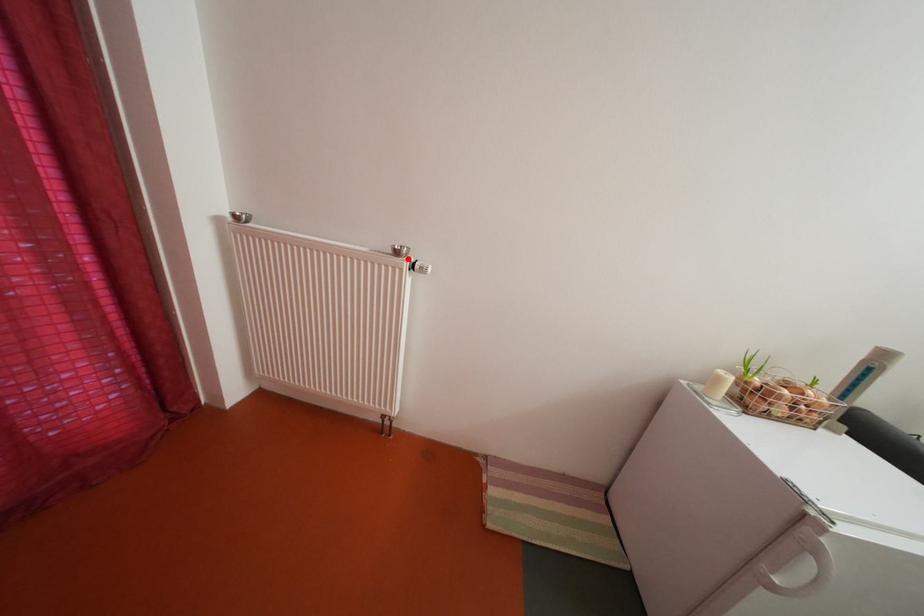
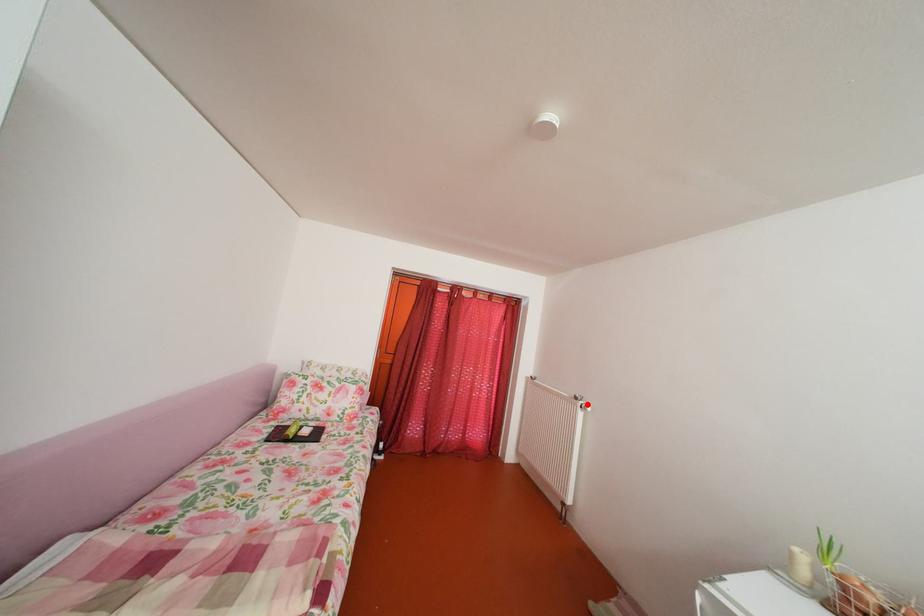
I am providing you with two images of the same scene from different viewpoints. A red point is marked on the first image and another point is marked on the second image. Is the red point in image1 aligned with the point shown in image2?

Yes